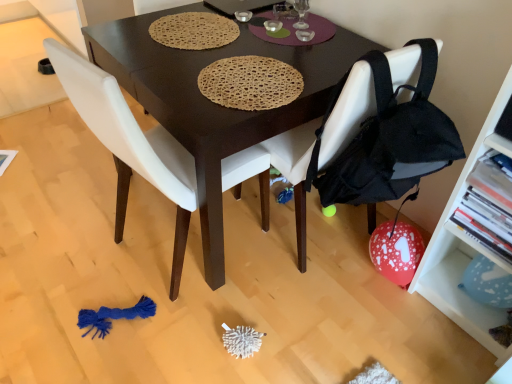
The image size is (512, 384). Describe the element at coordinates (213, 103) in the screenshot. I see `dark brown wood desk at center` at that location.

This screenshot has width=512, height=384. What do you see at coordinates (466, 247) in the screenshot?
I see `white matte shelf at right` at bounding box center [466, 247].

Where is `white matte chair at center, which ranks as the second chair in right-to-left order`? Image resolution: width=512 pixels, height=384 pixels. white matte chair at center, which ranks as the second chair in right-to-left order is located at coordinates (130, 145).

Measure the distance between white matte chair at center, marked as the 1th chair in a left-to-right arrangement, and camera.

The distance of white matte chair at center, marked as the 1th chair in a left-to-right arrangement, from camera is 3.43 feet.

This screenshot has height=384, width=512. I want to click on dark brown wood desk at center, so click(x=213, y=103).

Is point (456, 228) positioned behind point (298, 234)?

No.

Would you say white matte shelf at right is a long distance from black fabric chair at lower right, which is the second chair from left to right?

white matte shelf at right is near black fabric chair at lower right, which is the second chair from left to right, not far away.

Is white matte shelf at right bigger than black fabric chair at lower right, which is the second chair from left to right?

Incorrect, white matte shelf at right is not larger than black fabric chair at lower right, which is the second chair from left to right.

How much distance is there between white matte shelf at right and black fabric chair at lower right, acting as the first chair starting from the right?

The distance of white matte shelf at right from black fabric chair at lower right, acting as the first chair starting from the right, is 18.84 inches.

Is black fabric chair at lower right, which is the second chair from left to right, facing away from white matte chair at center, which ranks as the second chair in right-to-left order?

No, white matte chair at center, which ranks as the second chair in right-to-left order, is not at the back of black fabric chair at lower right, which is the second chair from left to right.

Which of these two, black fabric chair at lower right, acting as the first chair starting from the right, or white matte chair at center, which ranks as the second chair in right-to-left order, is wider?

white matte chair at center, which ranks as the second chair in right-to-left order.

Is point (375, 223) in front of point (268, 177)?

No, it is not.

Is black fabric chair at lower right, acting as the first chair starting from the right, in front of or behind white matte chair at center, which ranks as the second chair in right-to-left order, in the image?

black fabric chair at lower right, acting as the first chair starting from the right, is positioned farther from the viewer than white matte chair at center, which ranks as the second chair in right-to-left order.

Does white matte shelf at right have a greater height compared to dark brown wood desk at center?

Indeed, white matte shelf at right has a greater height compared to dark brown wood desk at center.

From the image's perspective, is white matte shelf at right positioned above or below dark brown wood desk at center?

Clearly, from the image's perspective, white matte shelf at right is below dark brown wood desk at center.

From a real-world perspective, who is located higher, white matte shelf at right or dark brown wood desk at center?

white matte shelf at right is physically above.

Is white matte shelf at right aimed at dark brown wood desk at center?

No, white matte shelf at right is not turned towards dark brown wood desk at center.

Identify the location of desk below the black fabric chair at lower right, acting as the first chair starting from the right (from a real-world perspective). This screenshot has width=512, height=384. (213, 103).

From a real-world perspective, which is physically below, black fabric chair at lower right, acting as the first chair starting from the right, or dark brown wood desk at center?

dark brown wood desk at center.

Can you tell me how much black fabric chair at lower right, acting as the first chair starting from the right, and dark brown wood desk at center differ in facing direction?

black fabric chair at lower right, acting as the first chair starting from the right, and dark brown wood desk at center are facing 94.5 degrees away from each other.

Is black fabric chair at lower right, acting as the first chair starting from the right, to the left or to the right of dark brown wood desk at center in the image?

In the image, black fabric chair at lower right, acting as the first chair starting from the right, appears on the right side of dark brown wood desk at center.

Locate an element on the screen. This screenshot has height=384, width=512. shelf that is on the right side of white matte chair at center, marked as the 1th chair in a left-to-right arrangement is located at coordinates (466, 247).

Choose the correct answer: Is white matte chair at center, which ranks as the second chair in right-to-left order, inside white matte shelf at right or outside it?

white matte chair at center, which ranks as the second chair in right-to-left order, is outside white matte shelf at right.

Does white matte chair at center, marked as the 1th chair in a left-to-right arrangement, come in front of white matte shelf at right?

No, white matte chair at center, marked as the 1th chair in a left-to-right arrangement, is further to the viewer.

Is dark brown wood desk at center turned away from white matte chair at center, which ranks as the second chair in right-to-left order?

No.

Is dark brown wood desk at center taller than white matte chair at center, marked as the 1th chair in a left-to-right arrangement?

No, dark brown wood desk at center is not taller than white matte chair at center, marked as the 1th chair in a left-to-right arrangement.

Can you see dark brown wood desk at center touching white matte chair at center, marked as the 1th chair in a left-to-right arrangement?

No, dark brown wood desk at center is not touching white matte chair at center, marked as the 1th chair in a left-to-right arrangement.

Can you confirm if dark brown wood desk at center is positioned to the left of white matte shelf at right?

Yes.

Is dark brown wood desk at center facing towards white matte shelf at right?

No.

Which of these two, dark brown wood desk at center or white matte shelf at right, stands taller?

With more height is white matte shelf at right.

Is dark brown wood desk at center not close to white matte shelf at right?

No, dark brown wood desk at center is not far away from white matte shelf at right.

Find the location of a particular element. This screenshot has width=512, height=384. shelf below the black fabric chair at lower right, acting as the first chair starting from the right (from the image's perspective) is located at coordinates (466, 247).

The image size is (512, 384). Find the location of `chair located underneath the black fabric chair at lower right, which is the second chair from left to right (from a real-world perspective)`. chair located underneath the black fabric chair at lower right, which is the second chair from left to right (from a real-world perspective) is located at coordinates (130, 145).

From the image, which object appears to be nearer to white matte shelf at right, dark brown wood desk at center or white matte chair at center, which ranks as the second chair in right-to-left order?

dark brown wood desk at center.

Estimate the real-world distances between objects in this image. Which object is closer to white matte chair at center, which ranks as the second chair in right-to-left order, black fabric chair at lower right, which is the second chair from left to right, or dark brown wood desk at center?

Among the two, dark brown wood desk at center is located nearer to white matte chair at center, which ranks as the second chair in right-to-left order.

From the image, which object appears to be nearer to white matte chair at center, which ranks as the second chair in right-to-left order, dark brown wood desk at center or black fabric chair at lower right, which is the second chair from left to right?

dark brown wood desk at center.

Which object lies nearer to the anchor point black fabric chair at lower right, which is the second chair from left to right, white matte shelf at right or dark brown wood desk at center?

Among the two, dark brown wood desk at center is located nearer to black fabric chair at lower right, which is the second chair from left to right.

Considering their positions, is black fabric chair at lower right, which is the second chair from left to right, positioned closer to white matte shelf at right than dark brown wood desk at center?

black fabric chair at lower right, which is the second chair from left to right, is positioned closer to the anchor white matte shelf at right.

When comparing their distances from white matte shelf at right, does black fabric chair at lower right, acting as the first chair starting from the right, or white matte chair at center, marked as the 1th chair in a left-to-right arrangement, seem closer?

The object closer to white matte shelf at right is black fabric chair at lower right, acting as the first chair starting from the right.

Based on their spatial positions, is white matte chair at center, which ranks as the second chair in right-to-left order, or dark brown wood desk at center further from white matte shelf at right?

white matte chair at center, which ranks as the second chair in right-to-left order, is positioned further to the anchor white matte shelf at right.

Based on their spatial positions, is dark brown wood desk at center or black fabric chair at lower right, which is the second chair from left to right, further from white matte shelf at right?

dark brown wood desk at center lies further to white matte shelf at right than the other object.

This screenshot has width=512, height=384. Identify the location of chair between dark brown wood desk at center and white matte shelf at right in the horizontal direction. (348, 113).

Locate an element on the screen. The width and height of the screenshot is (512, 384). desk between white matte chair at center, marked as the 1th chair in a left-to-right arrangement, and white matte shelf at right is located at coordinates (213, 103).

The image size is (512, 384). I want to click on chair situated between white matte chair at center, which ranks as the second chair in right-to-left order, and white matte shelf at right from left to right, so click(x=348, y=113).

I want to click on desk between white matte chair at center, which ranks as the second chair in right-to-left order, and black fabric chair at lower right, which is the second chair from left to right, so click(x=213, y=103).